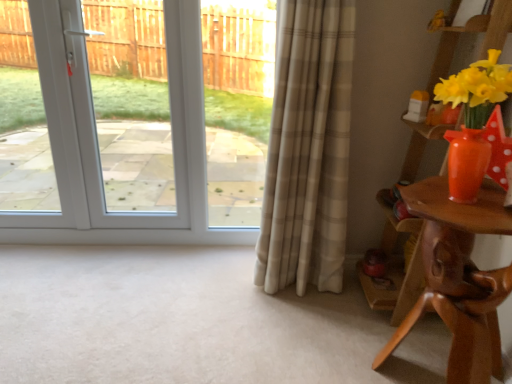
Question: Should I look upward or downward to see brown wooden table at right?

Choices:
 (A) up
 (B) down

Answer: (B)

Question: From a real-world perspective, is beige plaid curtain at center located higher than brown wooden table at right?

Choices:
 (A) no
 (B) yes

Answer: (B)

Question: Is beige plaid curtain at center bigger than brown wooden table at right?

Choices:
 (A) no
 (B) yes

Answer: (B)

Question: From the image's perspective, is beige plaid curtain at center over brown wooden table at right?

Choices:
 (A) yes
 (B) no

Answer: (A)

Question: From a real-world perspective, does beige plaid curtain at center sit lower than brown wooden table at right?

Choices:
 (A) yes
 (B) no

Answer: (B)

Question: Does beige plaid curtain at center have a greater height compared to brown wooden table at right?

Choices:
 (A) no
 (B) yes

Answer: (B)

Question: Does beige plaid curtain at center lie behind brown wooden table at right?

Choices:
 (A) no
 (B) yes

Answer: (B)

Question: Considering the relative sizes of brown wooden table at right and white glossy door at upper left in the image provided, is brown wooden table at right bigger than white glossy door at upper left?

Choices:
 (A) no
 (B) yes

Answer: (A)

Question: Is brown wooden table at right taller than white glossy door at upper left?

Choices:
 (A) no
 (B) yes

Answer: (A)

Question: Considering the relative sizes of brown wooden table at right and white glossy door at upper left in the image provided, is brown wooden table at right thinner than white glossy door at upper left?

Choices:
 (A) no
 (B) yes

Answer: (A)

Question: Considering the relative positions of brown wooden table at right and white glossy door at upper left in the image provided, is brown wooden table at right to the right of white glossy door at upper left from the viewer's perspective?

Choices:
 (A) yes
 (B) no

Answer: (A)

Question: Is brown wooden table at right shorter than white glossy door at upper left?

Choices:
 (A) yes
 (B) no

Answer: (A)

Question: From a real-world perspective, is brown wooden table at right located higher than white glossy door at upper left?

Choices:
 (A) yes
 (B) no

Answer: (B)

Question: Is white glossy door at upper left further to camera compared to matte orange vase at right?

Choices:
 (A) yes
 (B) no

Answer: (A)